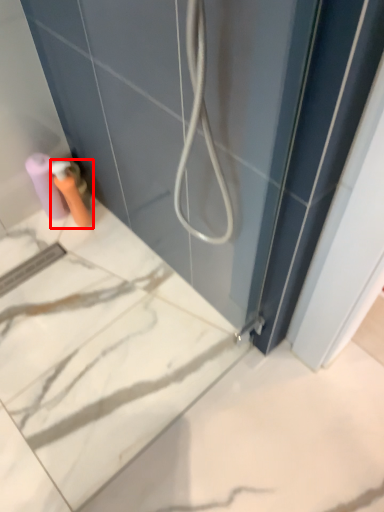
Question: Observing the image, what is the correct spatial positioning of toiletry (annotated by the red box) in reference to toilet paper?

Choices:
 (A) right
 (B) left

Answer: (A)